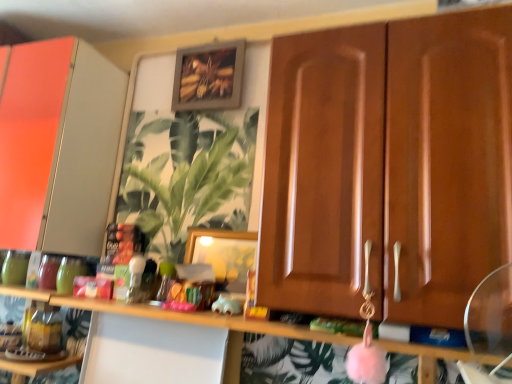
How much space does wooden picture frame at center, the 2th picture frame positioned from the back, occupy horizontally?

1.12 inches.

At what (x,y) coordinates should I click in order to perform the action: click on wooden picture frame at center, positioned as the first picture frame in bottom-to-top order. Please return your answer as a coordinate pair (x, y). The width and height of the screenshot is (512, 384). Looking at the image, I should click on (223, 255).

Find the location of a particular element. matte white cabinet at left, which ranks as the 1th cabinetry in back-to-front order is located at coordinates (58, 145).

The width and height of the screenshot is (512, 384). I want to click on pink fuzzy ball at center, so click(x=182, y=316).

At what (x,y) coordinates should I click in order to perform the action: click on wooden picture frame at center, acting as the 1th picture frame starting from the front. Please return your answer as a coordinate pair (x, y). Image resolution: width=512 pixels, height=384 pixels. Looking at the image, I should click on (223, 255).

Locate an element on the screen. The image size is (512, 384). picture frame that is the 1st one when counting rightward from the matte white cabinet at left, which ranks as the 1th cabinetry in back-to-front order is located at coordinates (209, 76).

Considering the sizes of objects matte white cabinet at left, which ranks as the 1th cabinetry in back-to-front order, and wooden frame at upper center, the 2th picture frame positioned from the bottom, in the image provided, who is wider, matte white cabinet at left, which ranks as the 1th cabinetry in back-to-front order, or wooden frame at upper center, the 2th picture frame positioned from the bottom,?

matte white cabinet at left, which ranks as the 1th cabinetry in back-to-front order, is wider.

Is matte white cabinet at left, which ranks as the 1th cabinetry in back-to-front order, aimed at wooden frame at upper center, which is the 1th picture frame in back-to-front order?

No.

Which of these two, wooden cabinet doors at center, the first cabinetry viewed from the right, or green leafy plant at center, is smaller?

green leafy plant at center is smaller.

Considering the relative sizes of wooden cabinet doors at center, which is the 2th cabinetry in left-to-right order, and green leafy plant at center in the image provided, is wooden cabinet doors at center, which is the 2th cabinetry in left-to-right order, taller than green leafy plant at center?

Yes, wooden cabinet doors at center, which is the 2th cabinetry in left-to-right order, is taller than green leafy plant at center.

Is the depth of wooden cabinet doors at center, the 2th cabinetry when ordered from back to front, greater than that of green leafy plant at center?

No, wooden cabinet doors at center, the 2th cabinetry when ordered from back to front, is closer to the viewer.

Can you confirm if pink fuzzy ball at center is thinner than green leafy plant at center?

No.

Considering the sizes of pink fuzzy ball at center and green leafy plant at center in the image, is pink fuzzy ball at center taller or shorter than green leafy plant at center?

pink fuzzy ball at center is shorter than green leafy plant at center.

Does point (184, 313) lie behind point (170, 226)?

No, it is not.

How far apart are pink fuzzy ball at center and green leafy plant at center?

18.39 inches.

Is green leafy plant at center shorter than pink fuzzy ball at center?

No.

Considering the points (124, 195) and (240, 321), which point is behind, point (124, 195) or point (240, 321)?

Point (124, 195)

Does green leafy plant at center lie behind pink fuzzy ball at center?

Yes, it is.

This screenshot has width=512, height=384. What are the coordinates of `shelf below the green leafy plant at center (from the image's perspective)` in the screenshot? It's located at (182, 316).

Does wooden picture frame at center, acting as the 1th picture frame starting from the front, appear on the right side of matte white cabinet at left, the 1th cabinetry positioned from the left?

Indeed, wooden picture frame at center, acting as the 1th picture frame starting from the front, is positioned on the right side of matte white cabinet at left, the 1th cabinetry positioned from the left.

Is wooden picture frame at center, positioned as the first picture frame in bottom-to-top order, next to matte white cabinet at left, the second cabinetry when ordered from front to back, and touching it?

There is a gap between wooden picture frame at center, positioned as the first picture frame in bottom-to-top order, and matte white cabinet at left, the second cabinetry when ordered from front to back.

Considering the positions of point (234, 251) and point (59, 191), is point (234, 251) closer or farther from the camera than point (59, 191)?

Point (234, 251).

Does wooden picture frame at center, positioned as the first picture frame in bottom-to-top order, lie behind matte white cabinet at left, which ranks as the 1th cabinetry in back-to-front order?

No, it is not.

What's the angular difference between pink fuzzy ball at center and wooden picture frame at center, acting as the 1th picture frame starting from the front,'s facing directions?

There is a 0.582-degree angle between the facing directions of pink fuzzy ball at center and wooden picture frame at center, acting as the 1th picture frame starting from the front.

How distant is pink fuzzy ball at center from wooden picture frame at center, the 2th picture frame positioned from the back?

They are 10.23 inches apart.

Is pink fuzzy ball at center placed right next to wooden picture frame at center, the 2th picture frame positioned from the back?

No, pink fuzzy ball at center is not beside wooden picture frame at center, the 2th picture frame positioned from the back.

The height and width of the screenshot is (384, 512). Identify the location of the 1st picture frame counting from the left of the pink fuzzy ball at center. (223, 255).

Is green leafy plant at center oriented away from matte white cabinet at left, the second cabinetry when ordered from front to back?

That's not correct — green leafy plant at center is not looking away from matte white cabinet at left, the second cabinetry when ordered from front to back.

From a real-world perspective, is green leafy plant at center physically located above or below matte white cabinet at left, the 2th cabinetry when ordered from right to left?

green leafy plant at center is below matte white cabinet at left, the 2th cabinetry when ordered from right to left.

Is green leafy plant at center at the left side of matte white cabinet at left, the 2th cabinetry when ordered from right to left?

No.

Locate an element on the screen. The width and height of the screenshot is (512, 384). the 1st cabinetry in front of the wooden frame at upper center, the 2th picture frame positioned from the bottom, starting your count from the anchor is located at coordinates (58, 145).

In the image, there is a wooden cabinet doors at center, the first cabinetry viewed from the right. Where is `houseplant above it (from the image's perspective)`? This screenshot has width=512, height=384. houseplant above it (from the image's perspective) is located at coordinates (186, 177).

Based on the photo, considering their positions, is wooden frame at upper center, which is the 1th picture frame in back-to-front order, positioned further to wooden cabinet doors at center, the 2th cabinetry when ordered from back to front, than pink fuzzy ball at center?

Based on the image, wooden frame at upper center, which is the 1th picture frame in back-to-front order, appears to be further to wooden cabinet doors at center, the 2th cabinetry when ordered from back to front.

Estimate the real-world distances between objects in this image. Which object is further from wooden frame at upper center, acting as the second picture frame starting from the front, wooden picture frame at center, the 2th picture frame when ordered from top to bottom, or pink fuzzy ball at center?

Among the two, pink fuzzy ball at center is located further to wooden frame at upper center, acting as the second picture frame starting from the front.

Looking at the image, which one is located closer to wooden frame at upper center, acting as the second picture frame starting from the front, wooden cabinet doors at center, which is the 2th cabinetry in left-to-right order, or matte white cabinet at left, which ranks as the 1th cabinetry in back-to-front order?

matte white cabinet at left, which ranks as the 1th cabinetry in back-to-front order, is closer to wooden frame at upper center, acting as the second picture frame starting from the front.

Estimate the real-world distances between objects in this image. Which object is further from pink fuzzy ball at center, matte white cabinet at left, which ranks as the 1th cabinetry in back-to-front order, or wooden frame at upper center, acting as the second picture frame starting from the front?

wooden frame at upper center, acting as the second picture frame starting from the front.

When comparing their distances from wooden cabinet doors at center, which is the 2th cabinetry in left-to-right order, does wooden picture frame at center, the 2th picture frame positioned from the back, or green leafy plant at center seem further?

green leafy plant at center lies further to wooden cabinet doors at center, which is the 2th cabinetry in left-to-right order, than the other object.

Looking at the image, which one is located further to pink fuzzy ball at center, matte white cabinet at left, which ranks as the 1th cabinetry in back-to-front order, or wooden cabinet doors at center, the first cabinetry viewed from the right?

matte white cabinet at left, which ranks as the 1th cabinetry in back-to-front order, is positioned further to the anchor pink fuzzy ball at center.

From the image, which object appears to be farther from matte white cabinet at left, which ranks as the 1th cabinetry in back-to-front order, green leafy plant at center or wooden frame at upper center, the 2th picture frame positioned from the bottom?

wooden frame at upper center, the 2th picture frame positioned from the bottom, is positioned further to the anchor matte white cabinet at left, which ranks as the 1th cabinetry in back-to-front order.

Based on their spatial positions, is matte white cabinet at left, the second cabinetry when ordered from front to back, or pink fuzzy ball at center further from wooden frame at upper center, acting as the second picture frame starting from the front?

pink fuzzy ball at center.

At what (x,y) coordinates should I click in order to perform the action: click on shelf located between wooden cabinet doors at center, the 2th cabinetry when ordered from back to front, and green leafy plant at center in the depth direction. Please return your answer as a coordinate pair (x, y). Looking at the image, I should click on (182, 316).

Locate an element on the screen. houseplant between wooden frame at upper center, marked as the 1th picture frame in a top-to-bottom arrangement, and pink fuzzy ball at center in the up-down direction is located at coordinates tap(186, 177).

Find the location of a particular element. houseplant between matte white cabinet at left, the 1th cabinetry positioned from the left, and pink fuzzy ball at center is located at coordinates (186, 177).

Identify the location of picture frame between wooden frame at upper center, acting as the second picture frame starting from the front, and pink fuzzy ball at center in the up-down direction. (223, 255).